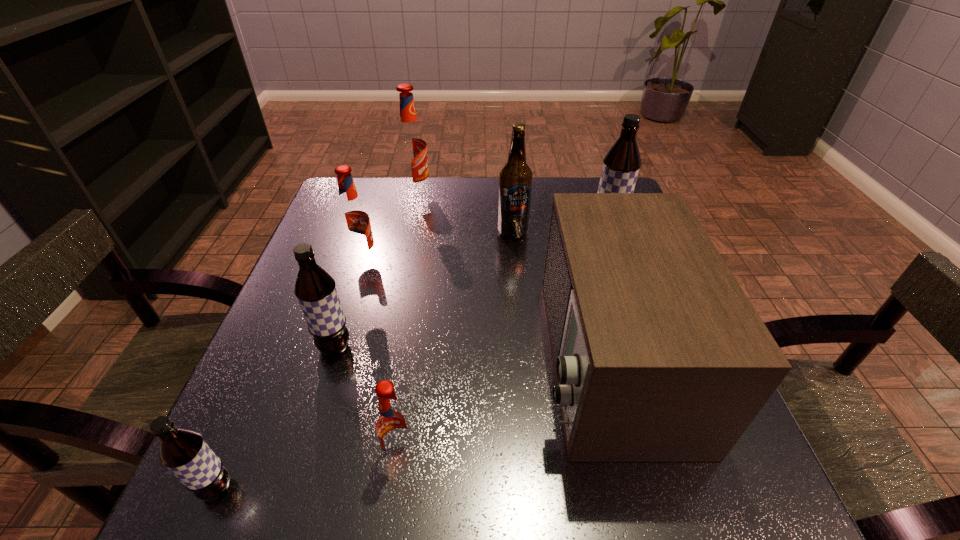
The width and height of the screenshot is (960, 540). I want to click on the nearest red root beer, so click(x=393, y=425).

I want to click on the second nearest root beer, so click(x=393, y=425).

Identify the location of the nearest root beer. The height and width of the screenshot is (540, 960). (184, 452).

At what (x,y) coordinates should I click in order to perform the action: click on the leftmost root beer. Please return your answer as a coordinate pair (x, y). Image resolution: width=960 pixels, height=540 pixels. Looking at the image, I should click on (184, 452).

The height and width of the screenshot is (540, 960). I want to click on free space located on the front of the farthest object, so click(x=403, y=256).

Find the location of a particular element. Image resolution: width=960 pixels, height=540 pixels. free point located on the left of the second farthest root beer is located at coordinates (502, 233).

Where is `vacant region located 0.350m on the label of the beer bottle`? This screenshot has width=960, height=540. vacant region located 0.350m on the label of the beer bottle is located at coordinates (524, 354).

Where is `vacant space positioned 0.270m on the back of the leftmost red root beer`? The width and height of the screenshot is (960, 540). vacant space positioned 0.270m on the back of the leftmost red root beer is located at coordinates (384, 192).

Identify the location of vacant space located on the left of the second farthest brown root beer. (291, 347).

Where is `vacant space situated 0.230m on the front-facing side of the radio receiver`? The width and height of the screenshot is (960, 540). vacant space situated 0.230m on the front-facing side of the radio receiver is located at coordinates (415, 359).